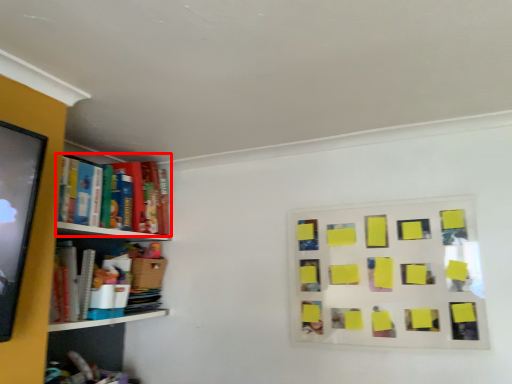
Question: From the image's perspective, considering the relative positions of book (annotated by the red box) and bulletin board in the image provided, where is book (annotated by the red box) located with respect to the staircase?

Choices:
 (A) above
 (B) below

Answer: (A)